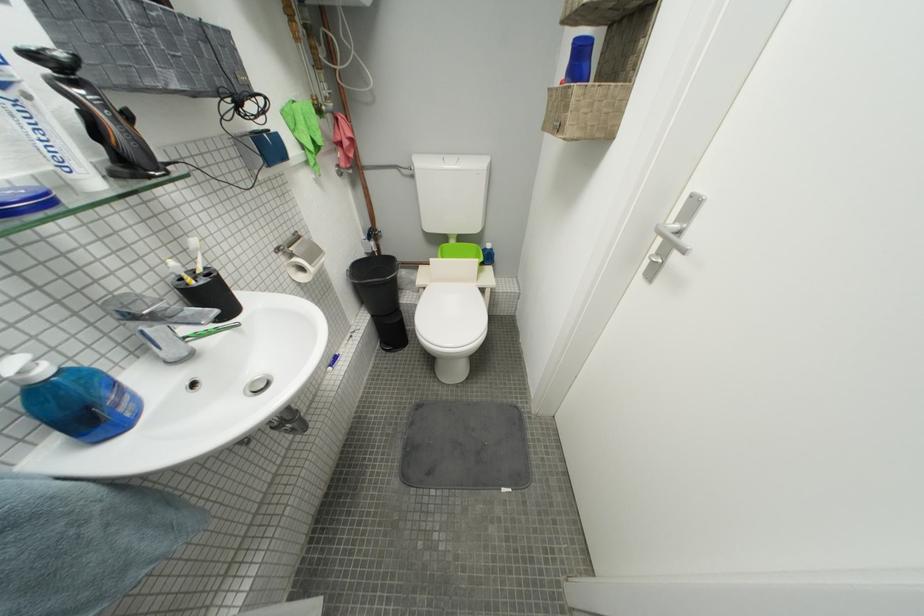
Where would you pull the silver door handle? Please return your answer as a coordinate pair (x, y).

(672, 237)